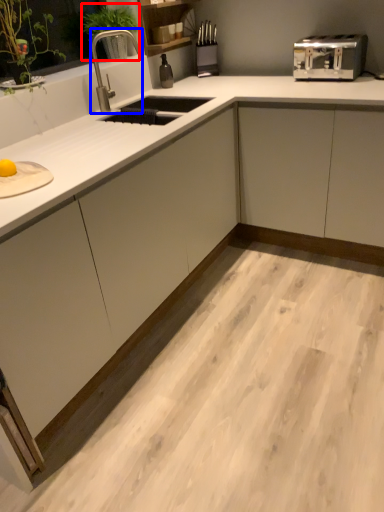
Question: Which object is further to the camera taking this photo, plant (highlighted by a red box) or faucet (highlighted by a blue box)?

Choices:
 (A) plant
 (B) faucet

Answer: (A)